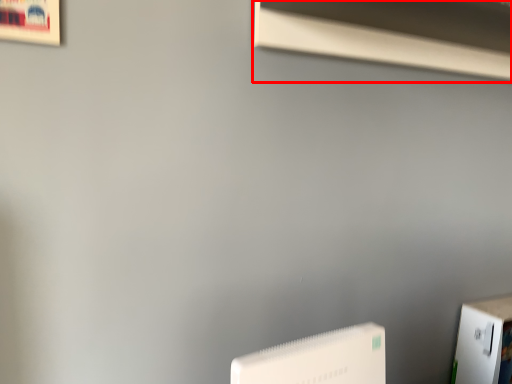
Question: From the image's perspective, where is window sill (annotated by the red box) located in relation to Wii in the image?

Choices:
 (A) above
 (B) below

Answer: (A)